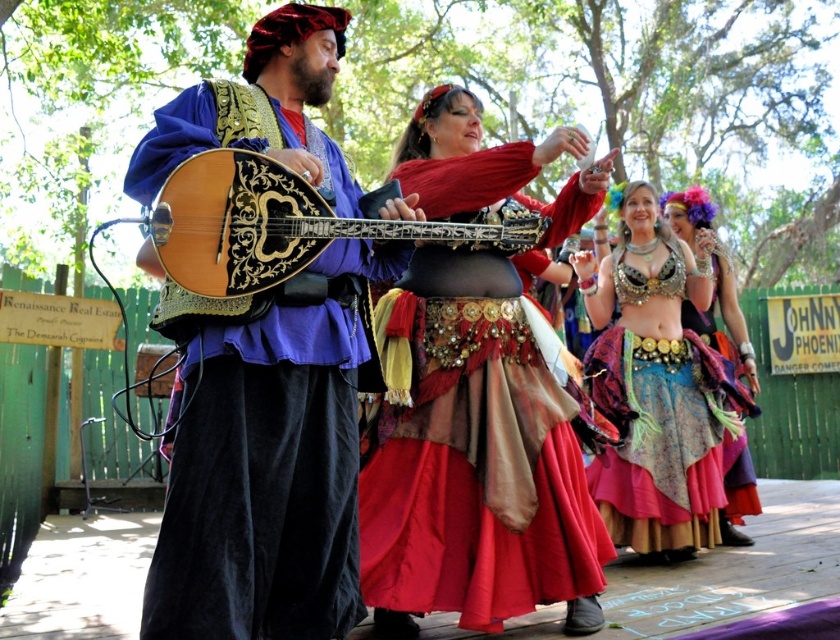
Can you confirm if velvet blue tunic at center is thinner than wooden glossy mandolin at center?

Indeed, velvet blue tunic at center has a lesser width compared to wooden glossy mandolin at center.

Does velvet blue tunic at center have a smaller size compared to wooden glossy mandolin at center?

No, velvet blue tunic at center is not smaller than wooden glossy mandolin at center.

This screenshot has height=640, width=840. What do you see at coordinates (266, 456) in the screenshot?
I see `velvet blue tunic at center` at bounding box center [266, 456].

Locate an element on the screen. The image size is (840, 640). velvet blue tunic at center is located at coordinates (266, 456).

Can you confirm if wooden glossy mandolin at center is smaller than multicolored fabric skirt at right?

No, wooden glossy mandolin at center is not smaller than multicolored fabric skirt at right.

Between wooden glossy mandolin at center and multicolored fabric skirt at right, which one has less height?

With less height is wooden glossy mandolin at center.

Image resolution: width=840 pixels, height=640 pixels. Describe the element at coordinates (281, 225) in the screenshot. I see `wooden glossy mandolin at center` at that location.

You are a GUI agent. You are given a task and a screenshot of the screen. Output one action in this format:
    pyautogui.click(x=<x>, y=<y>)
    Task: Click on the wooden glossy mandolin at center
    
    Given the screenshot: What is the action you would take?
    pyautogui.click(x=281, y=225)

Does point (575, 502) lie in front of point (651, 413)?

Yes, it is.

From the picture: Who is taller, shiny gold belt at center or multicolored fabric skirt at center?

multicolored fabric skirt at center is taller.

In order to click on shiny gold belt at center in this screenshot , I will do `click(471, 531)`.